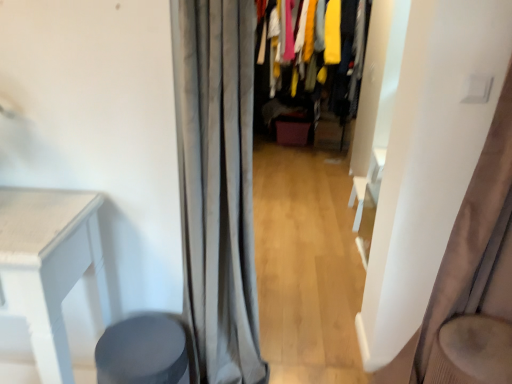
Question: Considering the relative sizes of velvet fabric clothes at center and gray fabric curtain at center, which is the first curtain from left to right, in the image provided, is velvet fabric clothes at center wider than gray fabric curtain at center, which is the first curtain from left to right,?

Choices:
 (A) yes
 (B) no

Answer: (A)

Question: Is velvet fabric clothes at center not within gray fabric curtain at center, which is the first curtain from left to right?

Choices:
 (A) yes
 (B) no

Answer: (A)

Question: From the image's perspective, does velvet fabric clothes at center appear higher than gray fabric curtain at center, which is the first curtain from left to right?

Choices:
 (A) yes
 (B) no

Answer: (A)

Question: Is there a large distance between velvet fabric clothes at center and gray fabric curtain at center, which is the first curtain from left to right?

Choices:
 (A) yes
 (B) no

Answer: (A)

Question: Is the surface of velvet fabric clothes at center in direct contact with gray fabric curtain at center, which is the 2th curtain in right-to-left order?

Choices:
 (A) yes
 (B) no

Answer: (B)

Question: Is satin beige curtain at right, arranged as the 2th curtain when viewed from the left, to the left or to the right of gray fabric curtain at center, which is the 2th curtain in right-to-left order, in the image?

Choices:
 (A) right
 (B) left

Answer: (A)

Question: Looking at their shapes, would you say satin beige curtain at right, arranged as the 2th curtain when viewed from the left, is wider or thinner than gray fabric curtain at center, which is the first curtain from left to right?

Choices:
 (A) thin
 (B) wide

Answer: (A)

Question: From a real-world perspective, is satin beige curtain at right, positioned as the 1th curtain in right-to-left order, above or below gray fabric curtain at center, which is the 2th curtain in right-to-left order?

Choices:
 (A) above
 (B) below

Answer: (A)

Question: Is satin beige curtain at right, arranged as the 2th curtain when viewed from the left, inside or outside of gray fabric curtain at center, which is the 2th curtain in right-to-left order?

Choices:
 (A) outside
 (B) inside

Answer: (A)

Question: From the image's perspective, is satin beige curtain at right, positioned as the 1th curtain in right-to-left order, above or below velvet fabric clothes at center?

Choices:
 (A) above
 (B) below

Answer: (B)

Question: Would you say satin beige curtain at right, arranged as the 2th curtain when viewed from the left, is to the left or to the right of velvet fabric clothes at center in the picture?

Choices:
 (A) left
 (B) right

Answer: (B)

Question: Is satin beige curtain at right, arranged as the 2th curtain when viewed from the left, in front of or behind velvet fabric clothes at center in the image?

Choices:
 (A) front
 (B) behind

Answer: (A)

Question: Is point (450, 304) closer or farther from the camera than point (343, 3)?

Choices:
 (A) farther
 (B) closer

Answer: (B)

Question: From the image's perspective, is velvet beige swivel chair at right above or below matte gray stool at lower left?

Choices:
 (A) above
 (B) below

Answer: (B)

Question: Is velvet beige swivel chair at right wider or thinner than matte gray stool at lower left?

Choices:
 (A) wide
 (B) thin

Answer: (A)